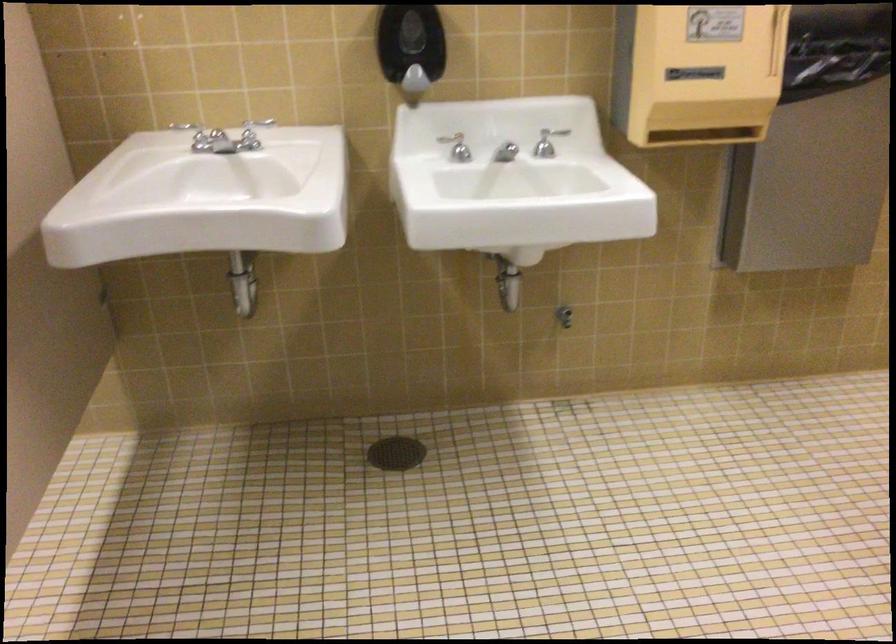
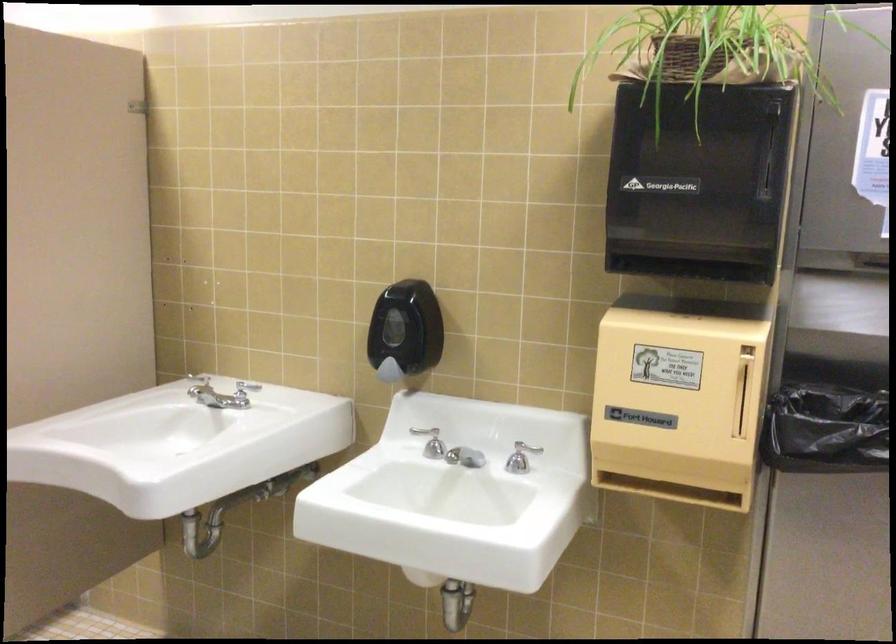
Locate, in the second image, the point that corresponds to point 455,152 in the first image.

(433, 444)